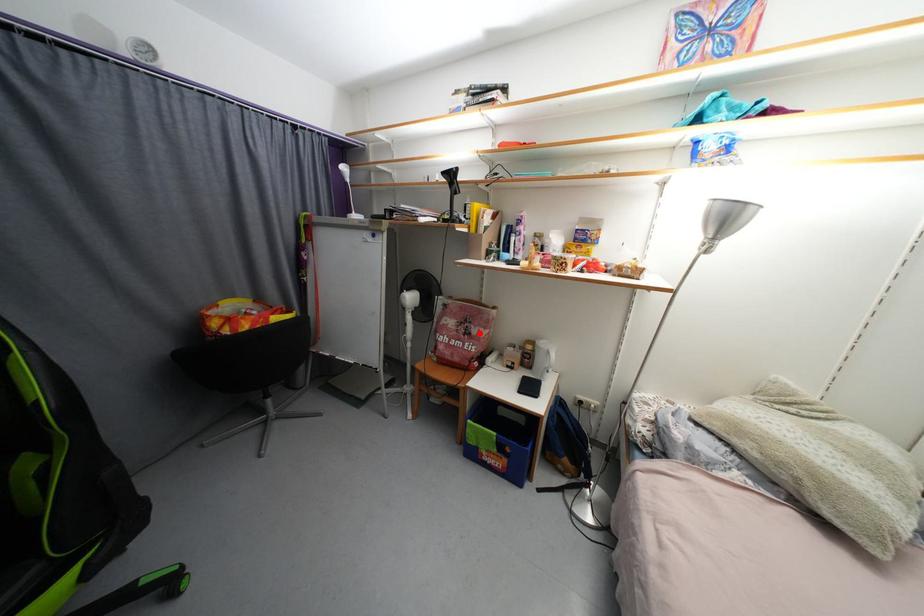
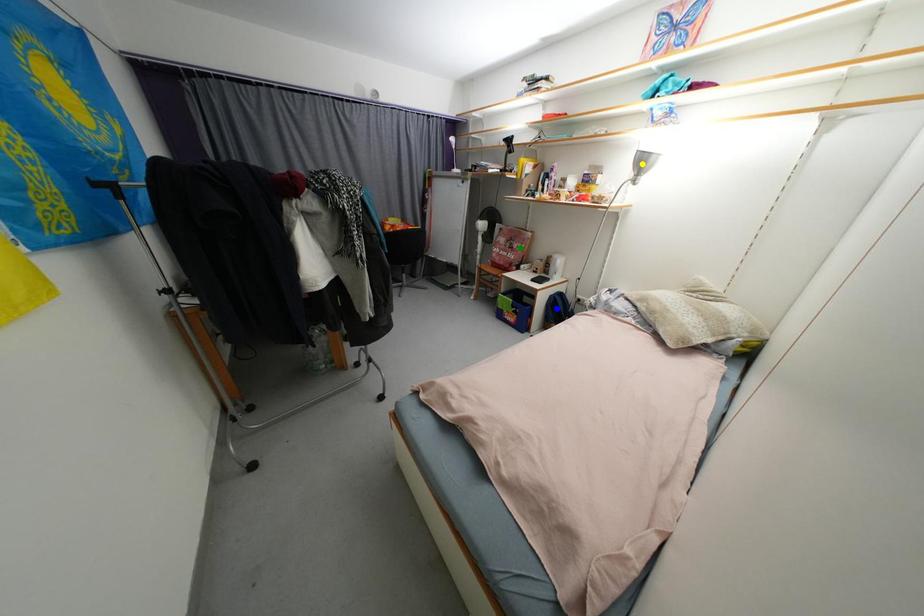
Question: I am providing you with two images of the same scene from different viewpoints. A red point is marked on the first image. You are given multiple points on the second image. Which spot in image 2 lines up with the point in image 1?

Choices:
 (A) yellow point
 (B) green point
 (C) blue point

Answer: (B)